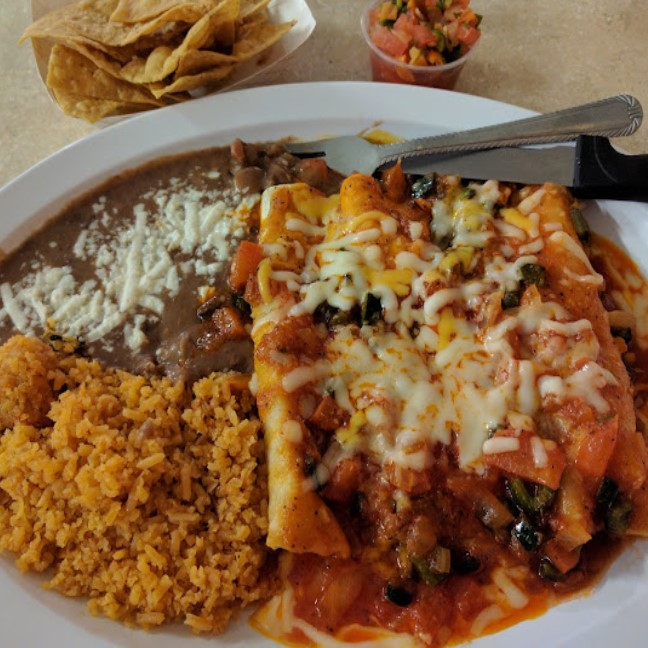
The image size is (648, 648). Find the location of `fork`. fork is located at coordinates (343, 157).